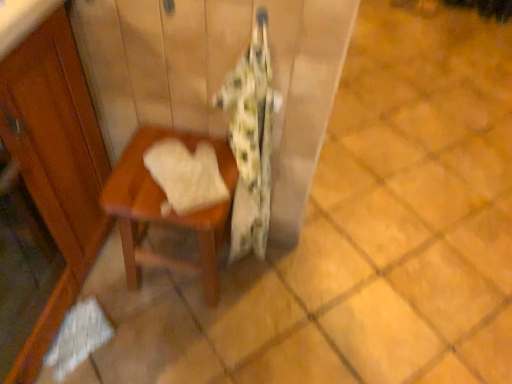
Locate an element on the screen. The width and height of the screenshot is (512, 384). vacant area on top of white soft towel at center (from a real-world perspective) is located at coordinates (187, 166).